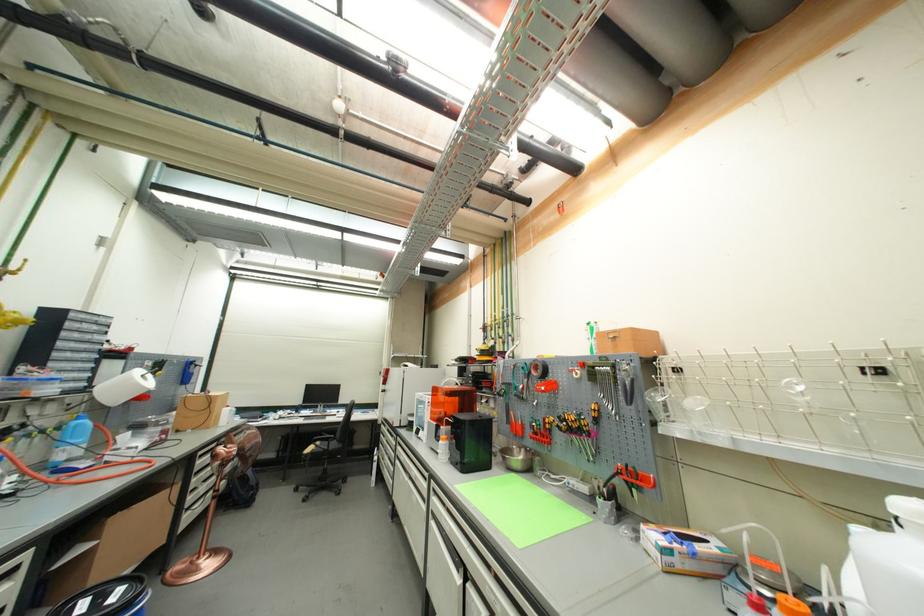
Find the location of a particular element. The width and height of the screenshot is (924, 616). red screwdriver handle is located at coordinates (545, 386).